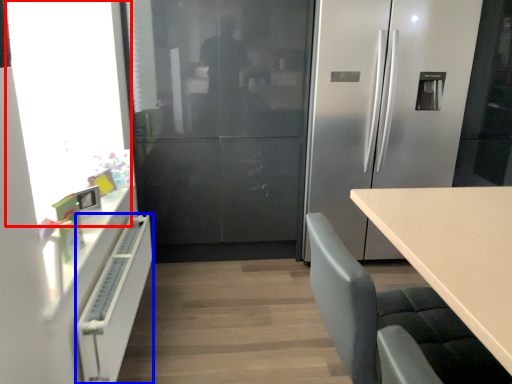
Question: Among these objects, which one is nearest to the camera, window screen (highlighted by a red box) or cabinetry (highlighted by a blue box)?

Choices:
 (A) window screen
 (B) cabinetry

Answer: (A)